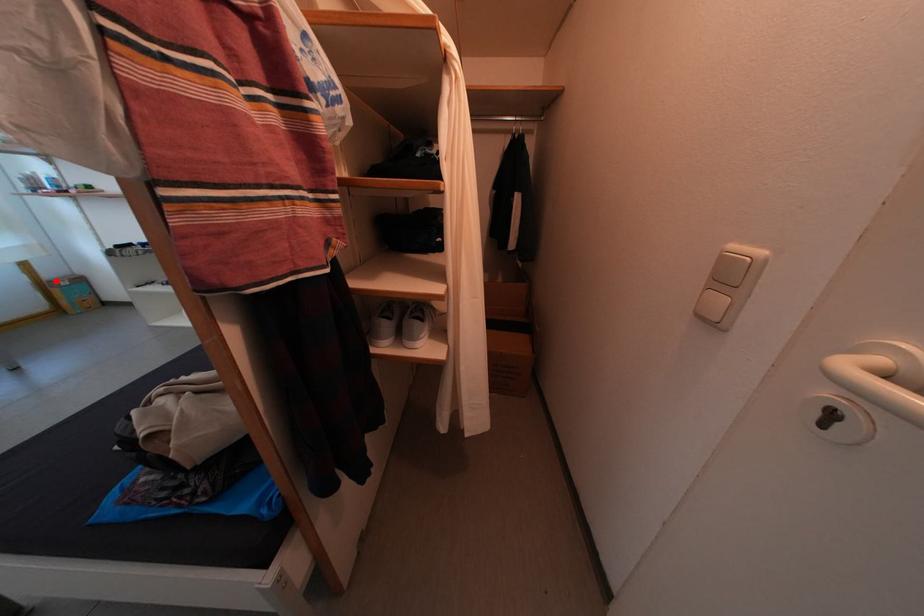
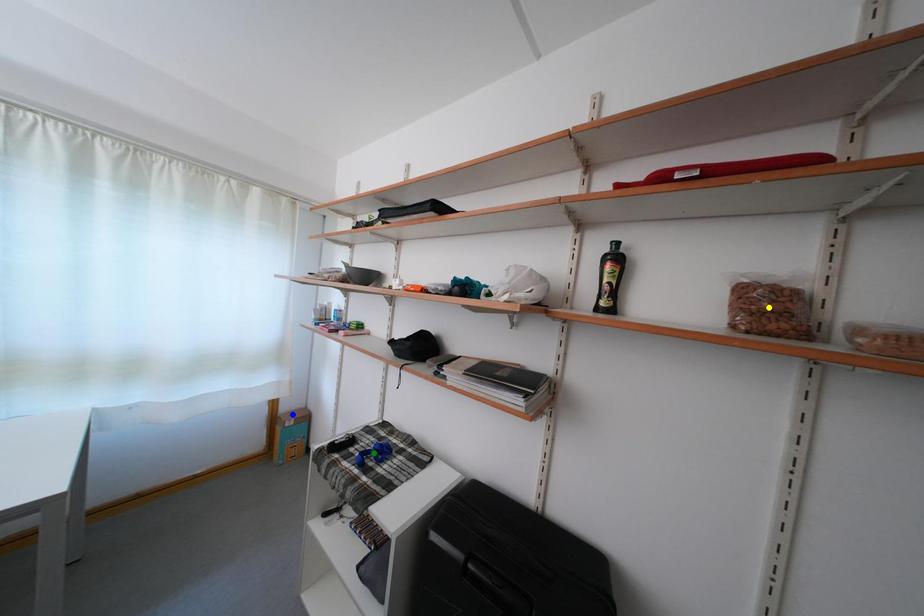
Question: I am providing you with two images of the same scene from different viewpoints. A red point is marked on the first image. You are given multiple points on the second image. Which point in image 2 represents the same 3d spot as the red point in image 1?

Choices:
 (A) yellow point
 (B) green point
 (C) blue point

Answer: (C)